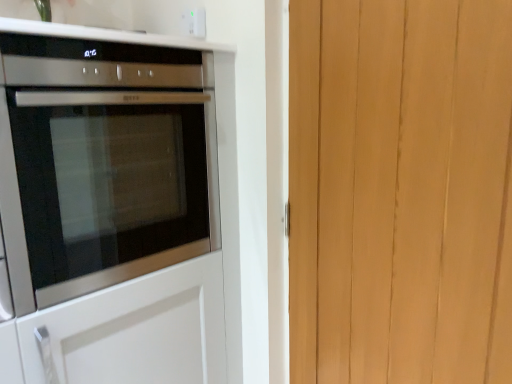
Where is `white plastic electric outlet at upper center`? white plastic electric outlet at upper center is located at coordinates (194, 22).

This screenshot has height=384, width=512. What do you see at coordinates (400, 191) in the screenshot? I see `light brown wood at right` at bounding box center [400, 191].

Identify the location of satin silver oven at left. (102, 163).

Considering the relative positions of white plastic electric outlet at upper center and satin silver oven at left in the image provided, is white plastic electric outlet at upper center to the left of satin silver oven at left from the viewer's perspective?

No, white plastic electric outlet at upper center is not to the left of satin silver oven at left.

Between white plastic electric outlet at upper center and satin silver oven at left, which one has smaller size?

white plastic electric outlet at upper center is smaller.

What's the angular difference between white plastic electric outlet at upper center and satin silver oven at left's facing directions?

white plastic electric outlet at upper center and satin silver oven at left are facing 90 degrees away from each other.

Is satin silver oven at left next to light brown wood at right?

satin silver oven at left is not next to light brown wood at right, and they're not touching.

From the image's perspective, which one is positioned lower, satin silver oven at left or light brown wood at right?

light brown wood at right, from the image's perspective.

Identify the location of barn door that appears below the satin silver oven at left (from a real-world perspective). The width and height of the screenshot is (512, 384). (400, 191).

Looking at this image, could you tell me if white plastic electric outlet at upper center is facing light brown wood at right?

No, white plastic electric outlet at upper center is not aimed at light brown wood at right.

From the image's perspective, would you say white plastic electric outlet at upper center is positioned over light brown wood at right?

Yes.

Relative to light brown wood at right, is white plastic electric outlet at upper center in front or behind?

Visually, white plastic electric outlet at upper center is located behind light brown wood at right.

From a real-world perspective, is satin silver oven at left physically below white plastic electric outlet at upper center?

Yes, from a real-world perspective, satin silver oven at left is below white plastic electric outlet at upper center.

What's the angular difference between satin silver oven at left and white plastic electric outlet at upper center's facing directions?

They differ by 90 degrees in their facing directions.

Does point (20, 41) lie in front of point (182, 23)?

Yes, it is.

Is white plastic electric outlet at upper center located within satin silver oven at left?

That's incorrect, white plastic electric outlet at upper center is not inside satin silver oven at left.

From a real-world perspective, is light brown wood at right positioned above or below white plastic electric outlet at upper center?

In terms of real-world spatial position, light brown wood at right is below white plastic electric outlet at upper center.

Which is farther from the camera, (365,15) or (192,31)?

The point (192,31) is farther.

Is light brown wood at right wider or thinner than white plastic electric outlet at upper center?

Clearly, light brown wood at right has more width compared to white plastic electric outlet at upper center.

In the scene shown: Is light brown wood at right far from white plastic electric outlet at upper center?

That's not correct — light brown wood at right is a little close to white plastic electric outlet at upper center.

Does light brown wood at right come behind satin silver oven at left?

No.

Where is `oven behind the light brown wood at right`? oven behind the light brown wood at right is located at coordinates (102, 163).

Is light brown wood at right aimed at satin silver oven at left?

No, light brown wood at right is not facing towards satin silver oven at left.

Considering the points (374, 373) and (137, 159), which point is in front, point (374, 373) or point (137, 159)?

Point (374, 373)

Where is `oven located below the white plastic electric outlet at upper center (from the image's perspective)`? oven located below the white plastic electric outlet at upper center (from the image's perspective) is located at coordinates (102, 163).

At what (x,y) coordinates should I click in order to perform the action: click on oven located above the light brown wood at right (from the image's perspective). Please return your answer as a coordinate pair (x, y). The image size is (512, 384). Looking at the image, I should click on (102, 163).

Looking at the image, which one is located closer to white plastic electric outlet at upper center, satin silver oven at left or light brown wood at right?

The object closer to white plastic electric outlet at upper center is satin silver oven at left.

When comparing their distances from white plastic electric outlet at upper center, does light brown wood at right or satin silver oven at left seem closer?

satin silver oven at left lies closer to white plastic electric outlet at upper center than the other object.

Based on their spatial positions, is satin silver oven at left or white plastic electric outlet at upper center closer to light brown wood at right?

Among the two, satin silver oven at left is located nearer to light brown wood at right.

Which object lies further to the anchor point light brown wood at right, white plastic electric outlet at upper center or satin silver oven at left?

Based on the image, white plastic electric outlet at upper center appears to be further to light brown wood at right.

Considering their positions, is white plastic electric outlet at upper center positioned further to satin silver oven at left than light brown wood at right?

Based on the image, light brown wood at right appears to be further to satin silver oven at left.

Looking at the image, which one is located further to satin silver oven at left, light brown wood at right or white plastic electric outlet at upper center?

The object further to satin silver oven at left is light brown wood at right.

This screenshot has height=384, width=512. I want to click on electric outlet located between satin silver oven at left and light brown wood at right in the left-right direction, so [x=194, y=22].